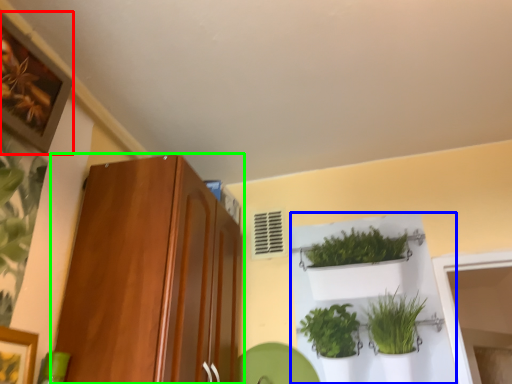
Question: Which object is positioned closest to picture frame (highlighted by a red box)? Select from shelf (highlighted by a blue box) and cabinetry (highlighted by a green box).

Choices:
 (A) shelf
 (B) cabinetry

Answer: (B)